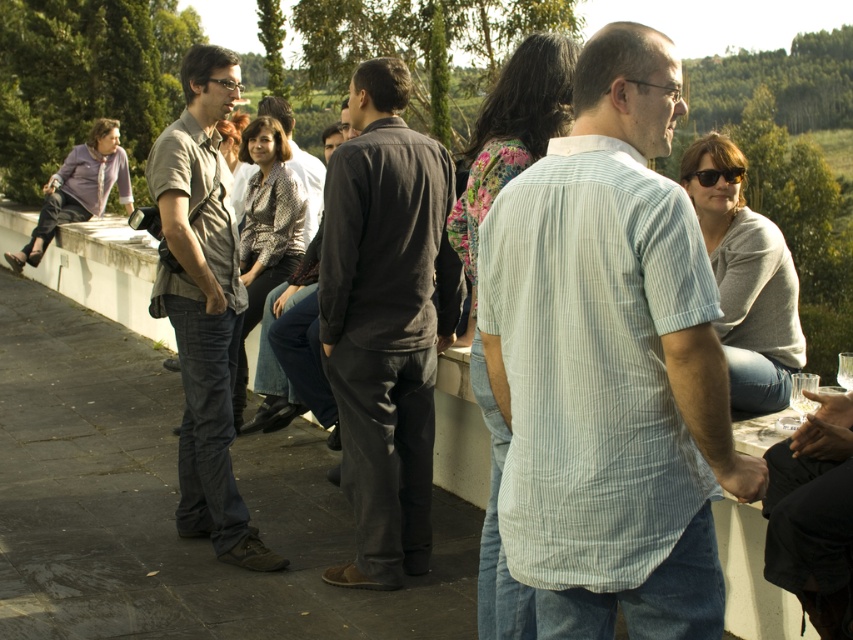
Is dark gray cotton shirt at center above metallic textured jacket at center?

No, dark gray cotton shirt at center is not above metallic textured jacket at center.

Is point (439, 275) positioned behind point (294, 161)?

No.

Which is behind, point (440, 147) or point (305, 237)?

The point (305, 237) is behind.

Where is `dark gray cotton shirt at center`? dark gray cotton shirt at center is located at coordinates (386, 321).

Can you confirm if denim jeans at center is shorter than metallic textured jacket at center?

No, denim jeans at center is not shorter than metallic textured jacket at center.

How far apart are denim jeans at center and metallic textured jacket at center?

denim jeans at center and metallic textured jacket at center are 5.98 feet apart.

Describe the element at coordinates (204, 305) in the screenshot. I see `denim jeans at center` at that location.

Where is `denim jeans at center`? The width and height of the screenshot is (853, 640). denim jeans at center is located at coordinates (204, 305).

Does dark gray cotton shirt at center have a larger size compared to denim jeans at center?

No, dark gray cotton shirt at center is not bigger than denim jeans at center.

Can you confirm if dark gray cotton shirt at center is positioned below denim jeans at center?

Yes, dark gray cotton shirt at center is below denim jeans at center.

Which is in front, point (447, 307) or point (196, 154)?

Point (196, 154) is in front.

Identify the location of dark gray cotton shirt at center. click(x=386, y=321).